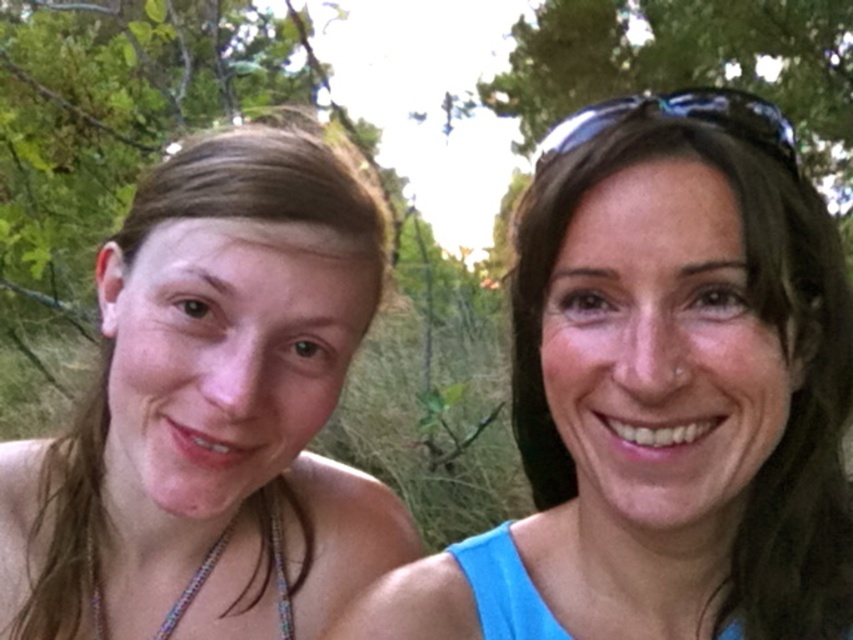
Question: Which point is closer to the camera taking this photo?

Choices:
 (A) (112, 445)
 (B) (567, 138)
 (C) (210, 554)

Answer: (B)

Question: Which point appears farthest from the camera in this image?

Choices:
 (A) (225, 532)
 (B) (39, 512)
 (C) (682, 369)

Answer: (A)

Question: Is blue fabric top at right wider than multicolored beaded necklace at lower left?

Choices:
 (A) no
 (B) yes

Answer: (B)

Question: Can you confirm if blue fabric top at right is positioned above multicolored beaded necklace at lower left?

Choices:
 (A) no
 (B) yes

Answer: (B)

Question: Which point is closer to the camera?

Choices:
 (A) blue fabric top at right
 (B) matte skin girl at left
 (C) multicolored beaded necklace at lower left

Answer: (A)

Question: Can you confirm if blue fabric top at right is bigger than matte skin girl at left?

Choices:
 (A) no
 (B) yes

Answer: (B)